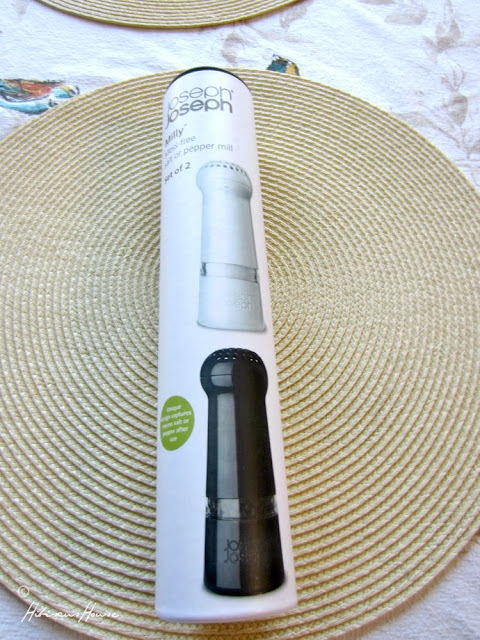
What are the coordinates of `surface` in the screenshot? It's located at (x=348, y=454).